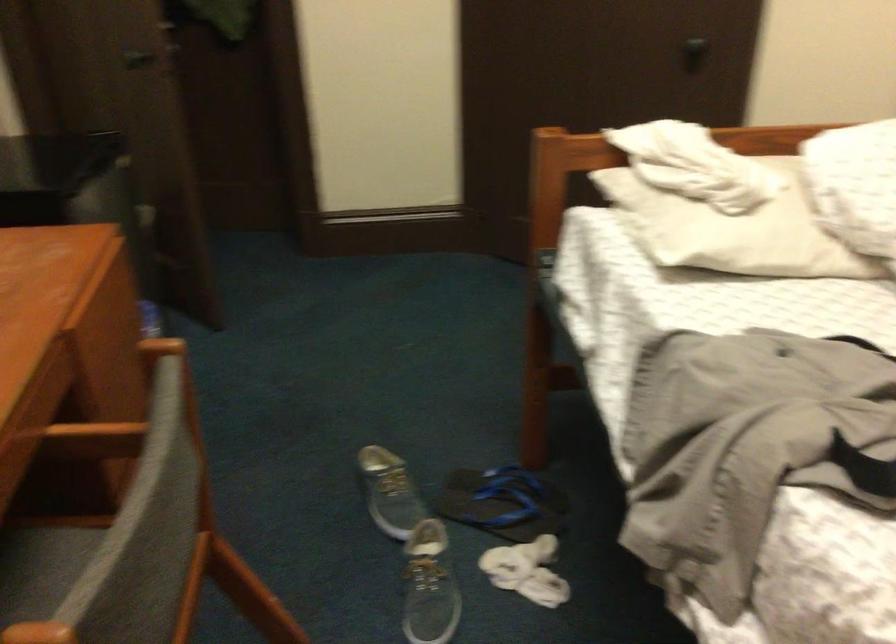
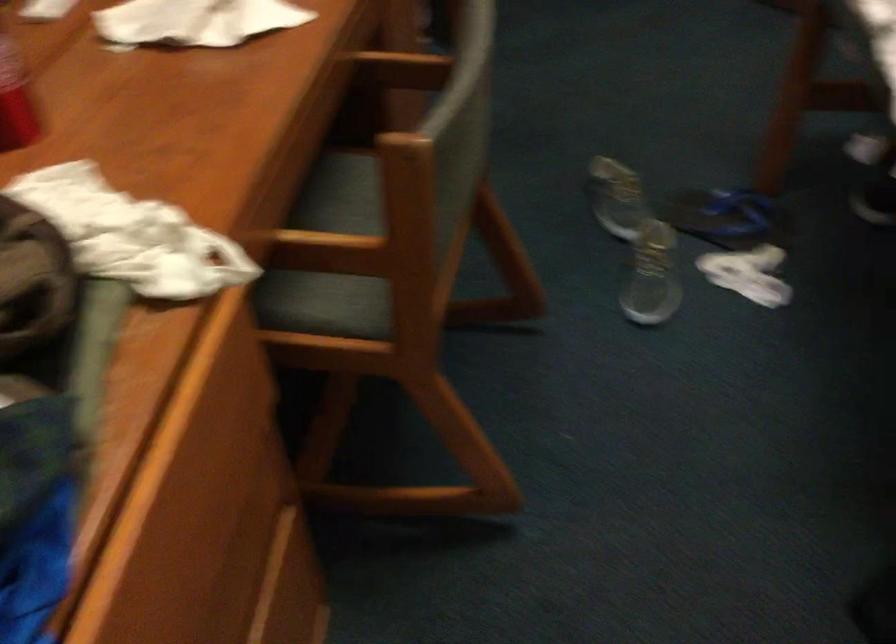
The point at (383, 498) is marked in the first image. Where is the corresponding point in the second image?

(616, 198)